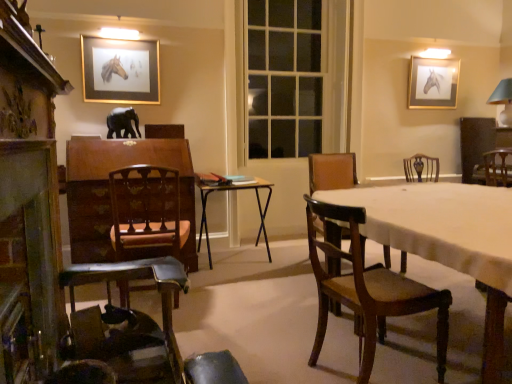
Image resolution: width=512 pixels, height=384 pixels. I want to click on free space to the left of brown leather chair at center, the 4th chair positioned from the left, so click(x=287, y=271).